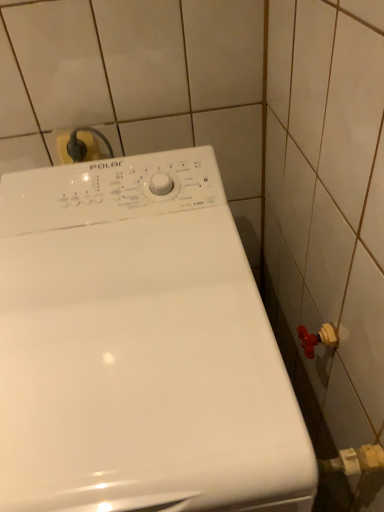
Question: From a real-world perspective, is yellow plastic plug at upper left on top of white glossy washing machine at center?

Choices:
 (A) no
 (B) yes

Answer: (B)

Question: Is yellow plastic plug at upper left directly adjacent to white glossy washing machine at center?

Choices:
 (A) yes
 (B) no

Answer: (B)

Question: Is yellow plastic plug at upper left thinner than white glossy washing machine at center?

Choices:
 (A) no
 (B) yes

Answer: (B)

Question: Considering the relative positions of yellow plastic plug at upper left and white glossy washing machine at center in the image provided, is yellow plastic plug at upper left in front of white glossy washing machine at center?

Choices:
 (A) yes
 (B) no

Answer: (B)

Question: From the image's perspective, is yellow plastic plug at upper left located beneath white glossy washing machine at center?

Choices:
 (A) yes
 (B) no

Answer: (B)

Question: Does yellow plastic plug at upper left appear on the left side of white glossy washing machine at center?

Choices:
 (A) no
 (B) yes

Answer: (B)

Question: Is white glossy washing machine at center to the left of yellow plastic plug at upper left from the viewer's perspective?

Choices:
 (A) yes
 (B) no

Answer: (B)

Question: Does white glossy washing machine at center have a smaller size compared to yellow plastic plug at upper left?

Choices:
 (A) no
 (B) yes

Answer: (A)

Question: Is yellow plastic plug at upper left inside white glossy washing machine at center?

Choices:
 (A) yes
 (B) no

Answer: (B)

Question: Can you confirm if white glossy washing machine at center is bigger than yellow plastic plug at upper left?

Choices:
 (A) yes
 (B) no

Answer: (A)

Question: From the image's perspective, is white glossy washing machine at center above yellow plastic plug at upper left?

Choices:
 (A) yes
 (B) no

Answer: (B)

Question: From the image's perspective, does white glossy washing machine at center appear lower than yellow plastic plug at upper left?

Choices:
 (A) yes
 (B) no

Answer: (A)

Question: In the image, is white glossy washing machine at center positioned in front of or behind yellow plastic plug at upper left?

Choices:
 (A) front
 (B) behind

Answer: (A)